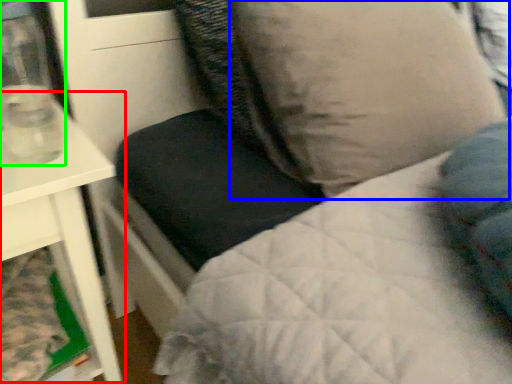
Question: Which object is the closest to the table (highlighted by a red box)? Choose among these: pillow (highlighted by a blue box) or glass vase (highlighted by a green box).

Choices:
 (A) pillow
 (B) glass vase

Answer: (B)